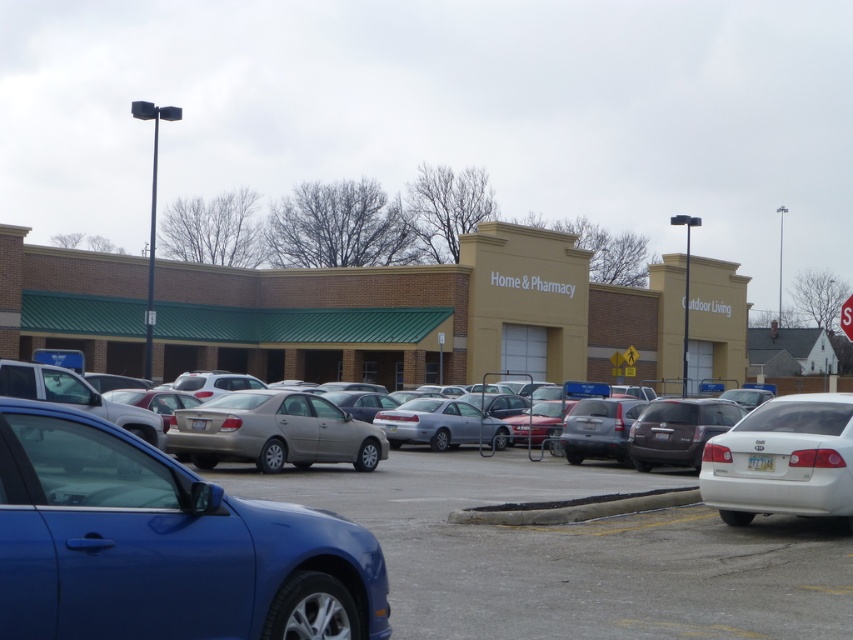
Question: Among these objects, which one is nearest to the camera?

Choices:
 (A) metallic silver stop sign at upper right
 (B) blue metallic car at lower left

Answer: (B)

Question: Does satin gold sedan at center have a greater width compared to metallic silver stop sign at upper right?

Choices:
 (A) yes
 (B) no

Answer: (B)

Question: In this image, where is brick building at center located relative to satin gold sedan at center?

Choices:
 (A) left
 (B) right

Answer: (B)

Question: Which of the following is the closest to the observer?

Choices:
 (A) (175, 634)
 (B) (837, 426)
 (C) (842, 330)
 (D) (688, 301)

Answer: (A)

Question: Estimate the real-world distances between objects in this image. Which object is closer to the shiny blue sedan at lower left?

Choices:
 (A) white glossy sedan at right
 (B) brick building at center
 (C) metallic silver stop sign at upper right

Answer: (A)

Question: Observing the image, what is the correct spatial positioning of white glossy sedan at right in reference to metallic silver stop sign at upper right?

Choices:
 (A) above
 (B) below

Answer: (B)